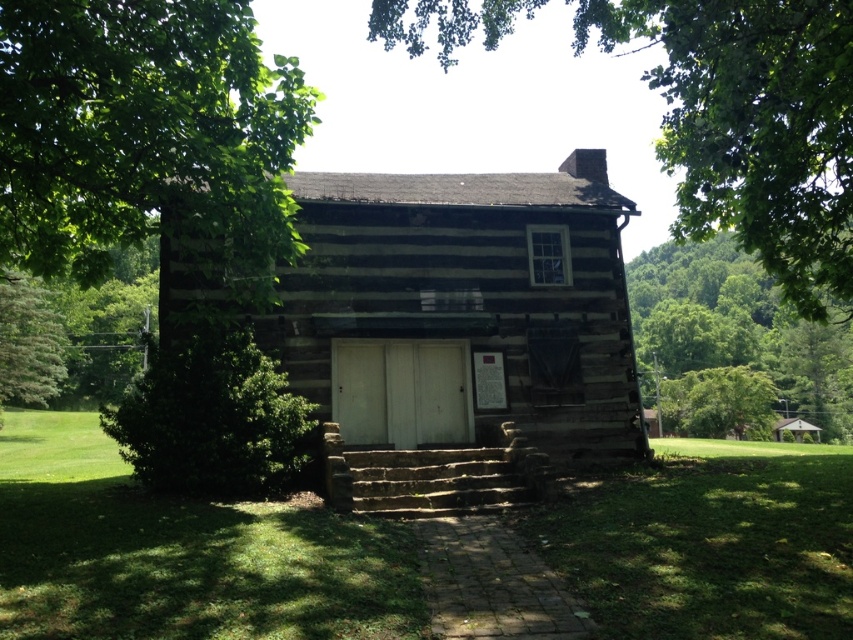
Question: In this image, where is green leafy bush at lower left located relative to green leafy tree at upper right?

Choices:
 (A) above
 (B) below

Answer: (B)

Question: In this image, where is green leafy tree at upper right located relative to stone steps at center?

Choices:
 (A) right
 (B) left

Answer: (A)

Question: Which point is farther from the camera taking this photo?

Choices:
 (A) (428, 481)
 (B) (223, 406)
 (C) (677, 147)

Answer: (C)

Question: Can you confirm if green leafy tree at upper center is positioned above green leafy tree at upper right?

Choices:
 (A) yes
 (B) no

Answer: (A)

Question: Which object is farther from the camera taking this photo?

Choices:
 (A) green leafy tree at upper right
 (B) green leafy tree at upper center
 (C) green leafy bush at lower left

Answer: (A)

Question: Among these points, which one is nearest to the camera?

Choices:
 (A) (576, 388)
 (B) (671, 260)
 (C) (787, 228)
 (D) (184, 189)

Answer: (D)